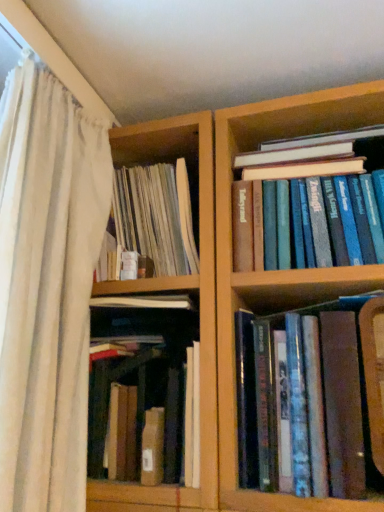
Question: Is blue hardcover books at upper right, which appears as the 3th book when viewed from the left, aimed at brown cardboard box at center, which is the 3th book from right to left?

Choices:
 (A) yes
 (B) no

Answer: (B)

Question: Considering the relative sizes of blue hardcover books at upper right, marked as the first book in a right-to-left arrangement, and brown cardboard box at center, which is the 3th book from right to left, in the image provided, is blue hardcover books at upper right, marked as the first book in a right-to-left arrangement, smaller than brown cardboard box at center, which is the 3th book from right to left,?

Choices:
 (A) no
 (B) yes

Answer: (B)

Question: Can we say blue hardcover books at upper right, which appears as the 3th book when viewed from the left, lies outside brown cardboard box at center, the 1th book from the left?

Choices:
 (A) no
 (B) yes

Answer: (B)

Question: Is blue hardcover books at upper right, marked as the first book in a right-to-left arrangement, positioned before brown cardboard box at center, which is the 3th book from right to left?

Choices:
 (A) yes
 (B) no

Answer: (B)

Question: From the image's perspective, is blue hardcover books at upper right, which appears as the 3th book when viewed from the left, located above or below brown cardboard box at center, which is the 3th book from right to left?

Choices:
 (A) above
 (B) below

Answer: (A)

Question: Which is correct: blue hardcover books at upper right, marked as the first book in a right-to-left arrangement, is inside brown cardboard box at center, which is the 3th book from right to left, or outside of it?

Choices:
 (A) outside
 (B) inside

Answer: (A)

Question: Is blue hardcover books at upper right, marked as the first book in a right-to-left arrangement, in front of or behind brown cardboard box at center, the 1th book from the left, in the image?

Choices:
 (A) front
 (B) behind

Answer: (B)

Question: Considering the positions of blue hardcover books at upper right, which appears as the 3th book when viewed from the left, and brown cardboard box at center, which is the 3th book from right to left, in the image, is blue hardcover books at upper right, which appears as the 3th book when viewed from the left, bigger or smaller than brown cardboard box at center, which is the 3th book from right to left,?

Choices:
 (A) big
 (B) small

Answer: (B)

Question: Based on their positions, is white sheer curtain at left located to the left or right of blue hardcover books at upper right, which appears as the 3th book when viewed from the left?

Choices:
 (A) left
 (B) right

Answer: (A)

Question: Relative to blue hardcover books at upper right, marked as the first book in a right-to-left arrangement, is white sheer curtain at left in front or behind?

Choices:
 (A) front
 (B) behind

Answer: (A)

Question: From a real-world perspective, is white sheer curtain at left above or below blue hardcover books at upper right, marked as the first book in a right-to-left arrangement?

Choices:
 (A) above
 (B) below

Answer: (B)

Question: From the image's perspective, is white sheer curtain at left above or below blue hardcover books at upper right, which appears as the 3th book when viewed from the left?

Choices:
 (A) below
 (B) above

Answer: (A)

Question: In the image, is brown leather book at lower right, the 2th book in the right-to-left sequence, positioned in front of or behind white sheer curtain at left?

Choices:
 (A) behind
 (B) front

Answer: (A)

Question: Is point (332, 392) closer or farther from the camera than point (84, 372)?

Choices:
 (A) closer
 (B) farther

Answer: (A)